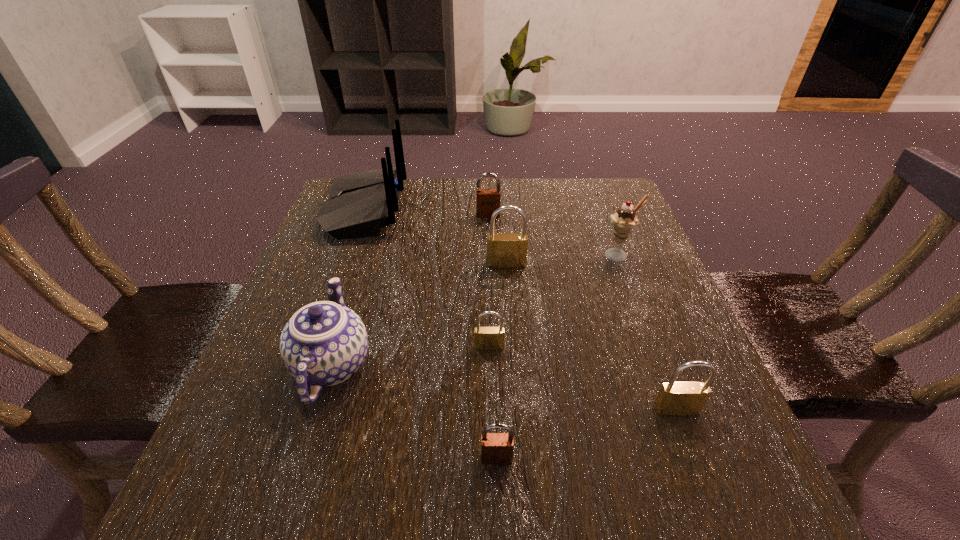
This screenshot has height=540, width=960. In order to click on object at the far left corner in this screenshot , I will do `click(360, 203)`.

Find the location of a particular element. free space at the far edge of the desktop is located at coordinates (527, 201).

The height and width of the screenshot is (540, 960). I want to click on vacant space at the near edge of the desktop, so click(x=527, y=501).

The width and height of the screenshot is (960, 540). What are the coordinates of `vacant space at the left edge of the desktop` in the screenshot? It's located at (328, 263).

Find the location of `free space at the right edge`. free space at the right edge is located at coordinates (663, 272).

The width and height of the screenshot is (960, 540). In the image, there is a desktop. Find the location of `vacant space at the far right corner`. vacant space at the far right corner is located at coordinates (577, 194).

At what (x,y) coordinates should I click in order to perform the action: click on free space at the near right corner. Please return your answer as a coordinate pair (x, y). The width and height of the screenshot is (960, 540). Looking at the image, I should click on (668, 482).

Where is `free space between the farther brown padlock and the chinaware`? free space between the farther brown padlock and the chinaware is located at coordinates (410, 290).

Find the location of a particular element. The height and width of the screenshot is (540, 960). unoccupied area between the tallest object and the chinaware is located at coordinates pyautogui.click(x=348, y=287).

The height and width of the screenshot is (540, 960). What are the coordinates of `vacant point located between the farther brown padlock and the tallest object` in the screenshot? It's located at (426, 212).